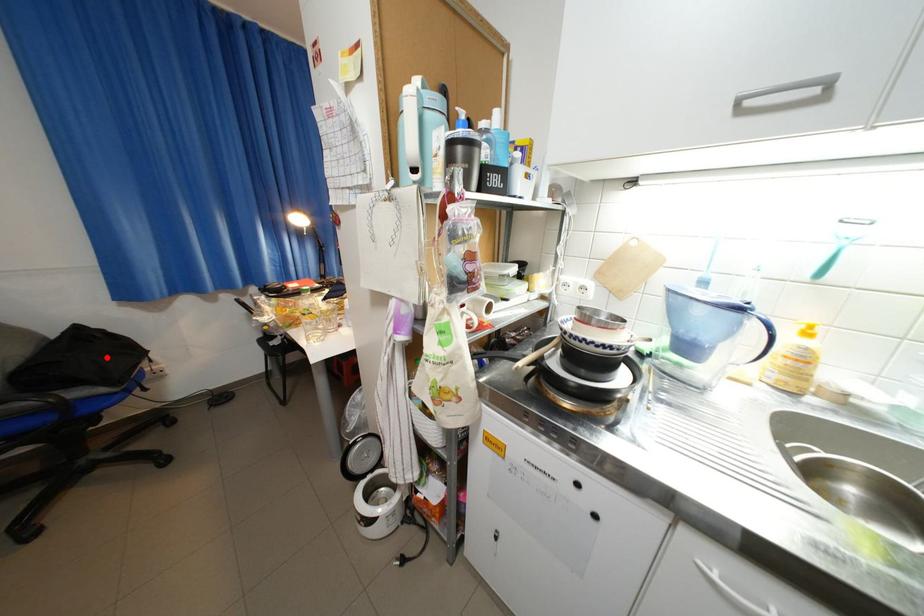
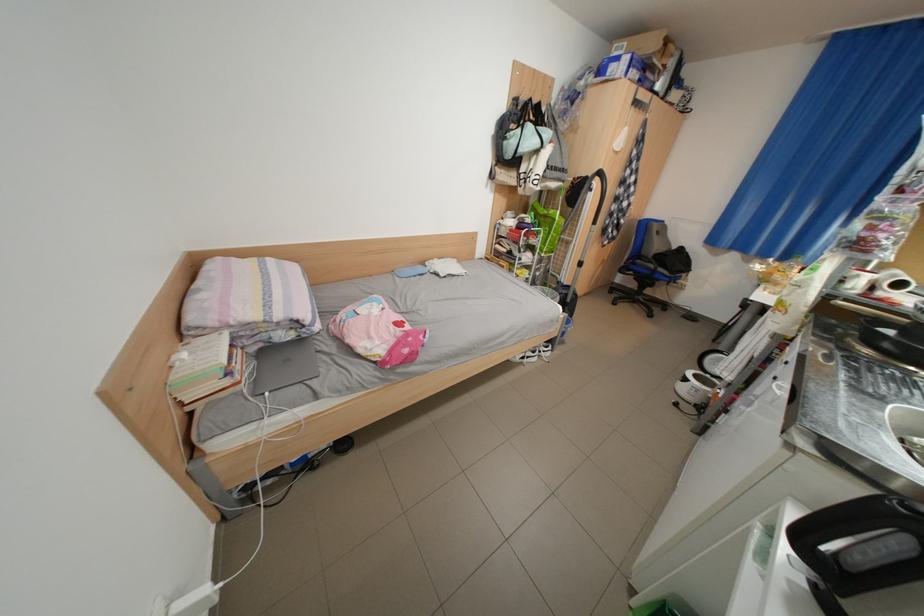
Where in the second image is the point corresponding to the highlighted location from the first image?

(687, 264)